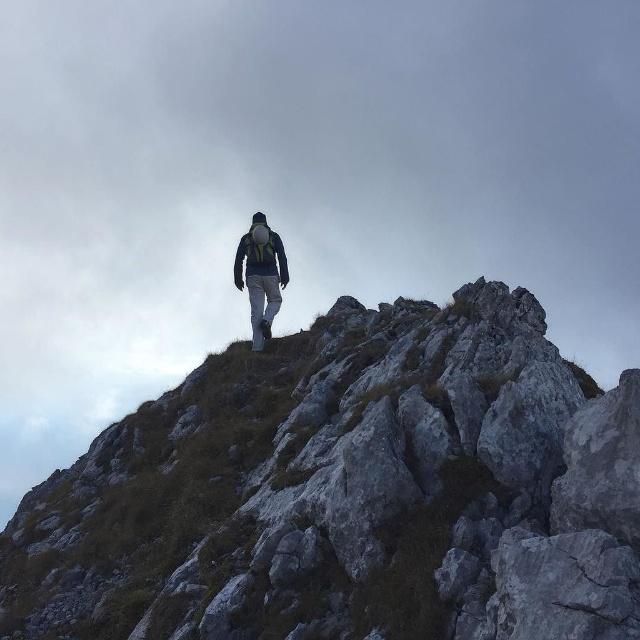
Who is higher up, gray rocky mountain at center or matte gray pants at center?

matte gray pants at center is higher up.

Is gray rocky mountain at center shorter than matte gray pants at center?

No, gray rocky mountain at center is not shorter than matte gray pants at center.

Which is in front, point (220, 529) or point (262, 269)?

Point (220, 529)

Identify the location of gray rocky mountain at center. The width and height of the screenshot is (640, 640). (349, 492).

Can you confirm if matte gray pants at center is positioned to the left of dark green fabric jacket at center?

Indeed, matte gray pants at center is positioned on the left side of dark green fabric jacket at center.

Based on the photo, does matte gray pants at center come behind dark green fabric jacket at center?

No, it is in front of dark green fabric jacket at center.

I want to click on matte gray pants at center, so click(x=260, y=276).

Based on the photo, can you confirm if gray rocky mountain at center is positioned above dark green fabric jacket at center?

Actually, gray rocky mountain at center is below dark green fabric jacket at center.

Is point (444, 589) positioned after point (248, 257)?

No, (444, 589) is in front of (248, 257).

Based on the photo, measure the distance between point (548, 531) and camera.

Point (548, 531) is 9.43 meters from camera.

Locate an element on the screen. The image size is (640, 640). gray rocky mountain at center is located at coordinates (349, 492).